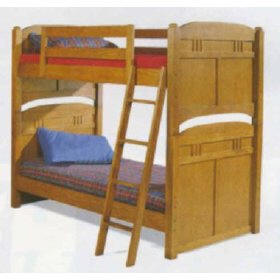
Locate an element on the screen. This screenshot has height=280, width=280. purple mattress is located at coordinates (79, 173).